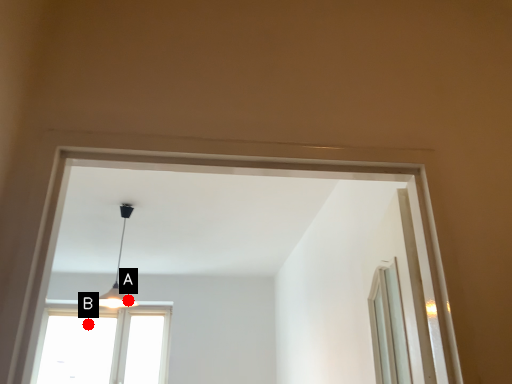
Question: Two points are circled on the image, labeled by A and B beside each circle. Among these points, which one is farthest from the camera?

Choices:
 (A) A is further
 (B) B is further

Answer: (A)